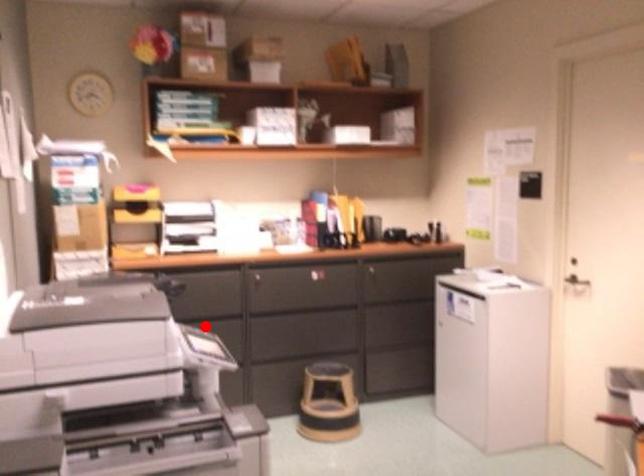
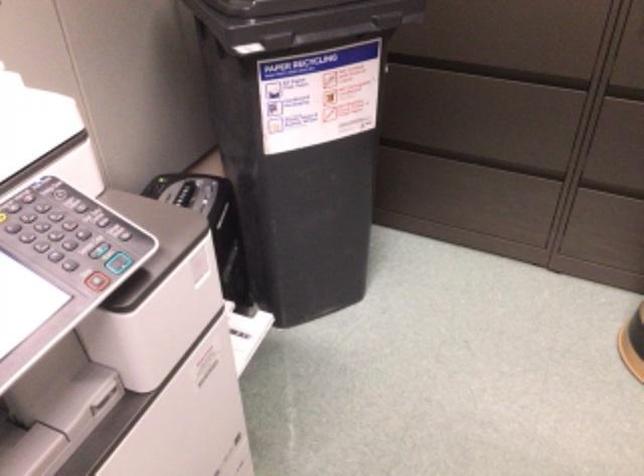
Question: A red point is marked in image1. In image2, is the corresponding 3D point closer to the camera or farther? Reply with the corresponding letter.

Choices:
 (A) The corresponding 3D point is closer.
 (B) The corresponding 3D point is farther.

Answer: (A)